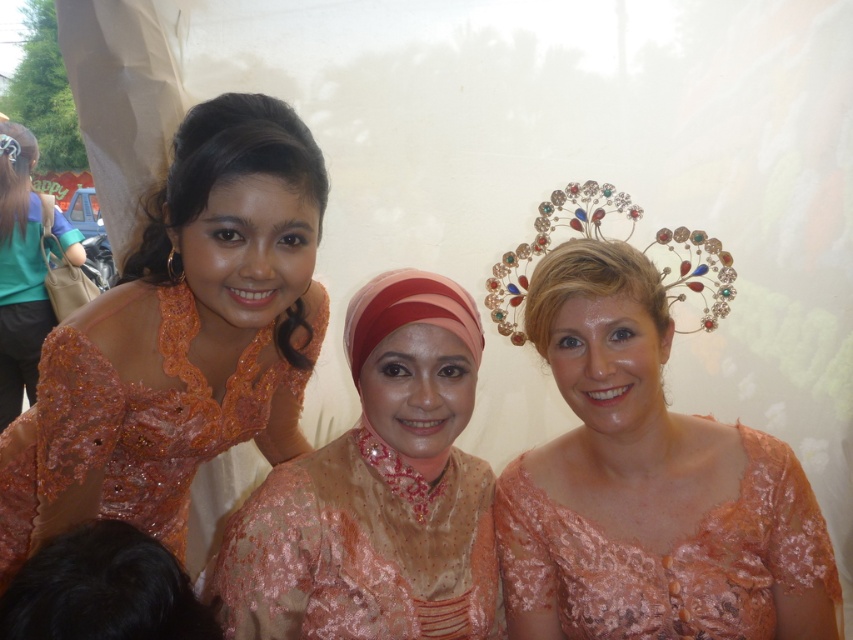
You are a photographer adjusting your camera settings to focus on two specific points in the image. The first point is at coordinates point (567, 636) and the second is at point (36, 250). Which point should you prioritize focusing on to ensure it appears sharp in the final photo?

Point (567, 636) is closer to the camera than point (36, 250), so focusing on point (567, 636) will ensure it appears sharp in the final photo.